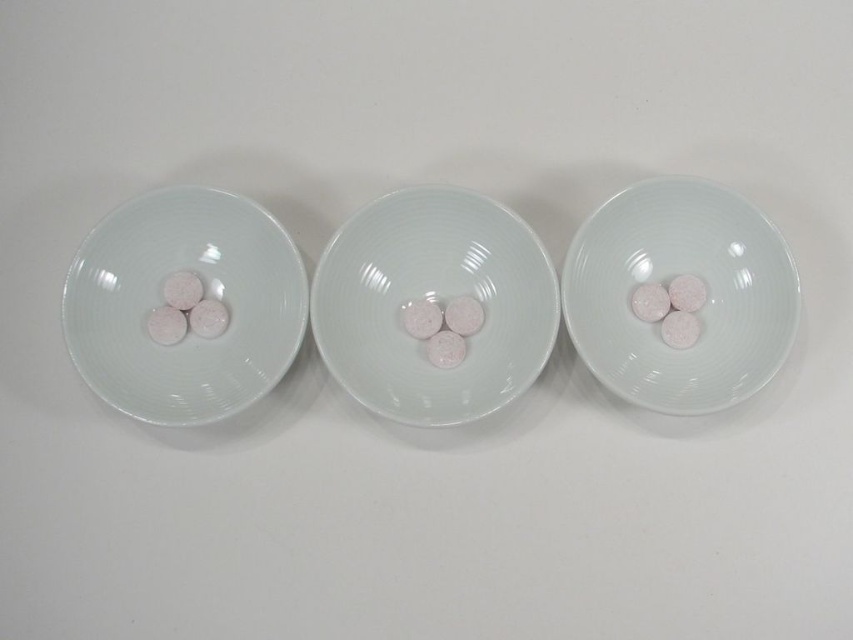
You are standing in front of the three white bowls arranged horizontally. You notice two specific points marked as point 1 and point 2. Point 1 is at coordinate (111, 360) and point 2 is at coordinate (706, 406). Which point is closer to you?

Point 1 at coordinate (111, 360) is closer to you than point 2 at coordinate (706, 406) because it is further to the viewer.

You are setting up a table for a small gathering and have a decorative vase that is 22 centimeters wide. You want to place it between the porcelain bowls at center and the matte white plate at right. Will there be enough space for the vase without overlapping either item?

The porcelain bowls at center is 21.94 centimeters away from matte white plate at right. Since the distance between them is slightly less than the vase width of 22 centimeters, the vase will not fit without overlapping either item.

You are arranging dishes on a shelf and need to place the porcelain bowls at center and the matte white plate at right. Which item should you place first if you want to follow the rule of placing items closer to the viewer first?

You should place the porcelain bowls at center first because it is closer to the viewer than the matte white plate at right.